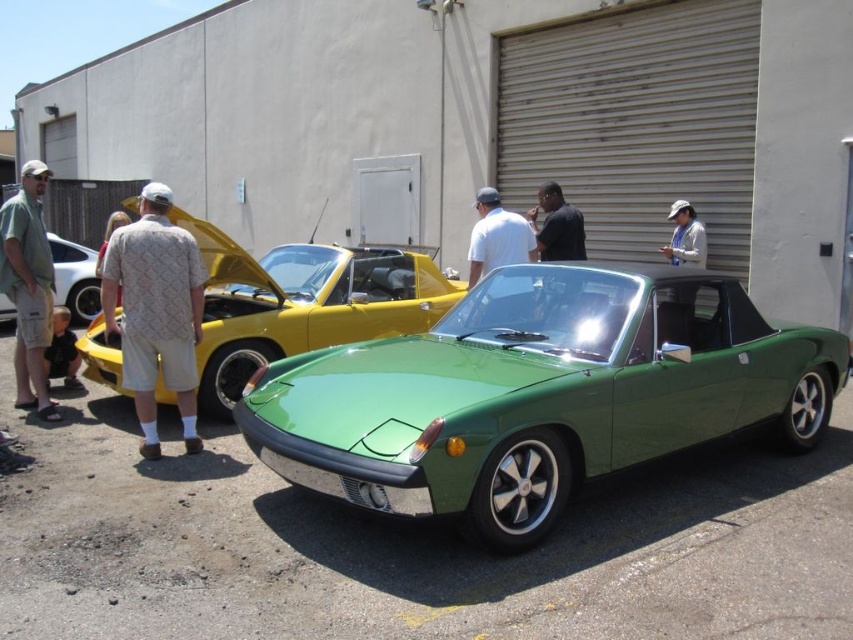
You are a photographer standing at the location of the green fabric shirt at left. You want to take a photo of the green matte sports car at center without anyone in the frame. The minimum focusing distance of your camera is 8 feet. Can you take the photo without moving?

The distance between the green matte sports car at center and the green fabric shirt at left is 9.12 feet, which is greater than the camera minimum focusing distance of 8 feet. Therefore, you can take the photo without moving as the distance is sufficient.

You are a photographer trying to capture a clear shot of the green matte sports car at center and the white matte baseball cap at upper center. Since you want to ensure both are visible, which object should you focus on first to avoid blurriness?

The green matte sports car at center is bigger than the white matte baseball cap at upper center, so you should focus on the green matte sports car at center first to ensure it is sharp, as larger objects often require more precise focus to avoid blurriness.

Based on the photo, you are standing in front of the two vintage cars at the car show. There are two points marked in the image. The first point is at coordinate point (59, 268) and the second is at point (572, 228). If you were to walk towards the building with the large metal rollup door, which point would you pass first?

Point (59, 268) is closer to you than point (572, 228), so you would pass point (59, 268) first as you walk towards the building with the large metal rollup door.